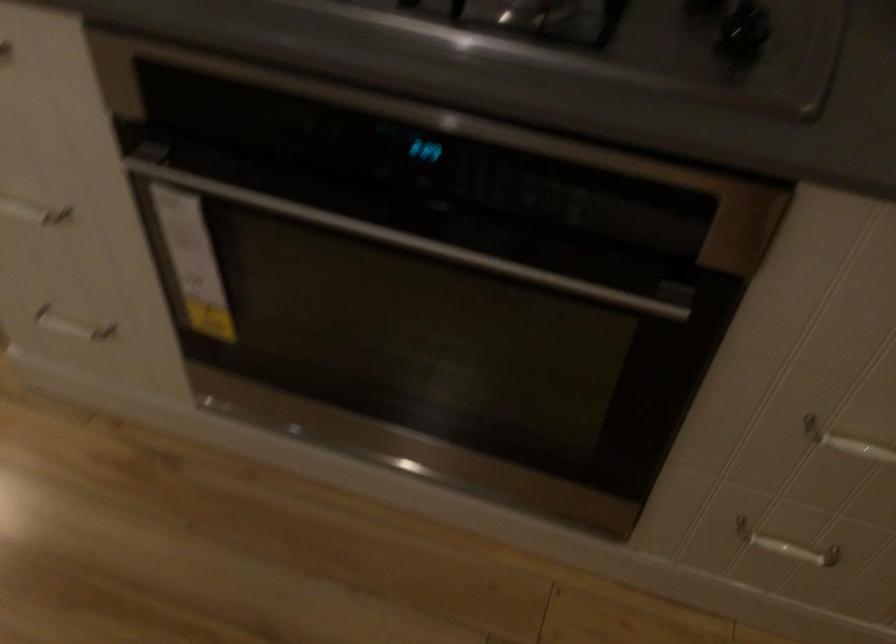
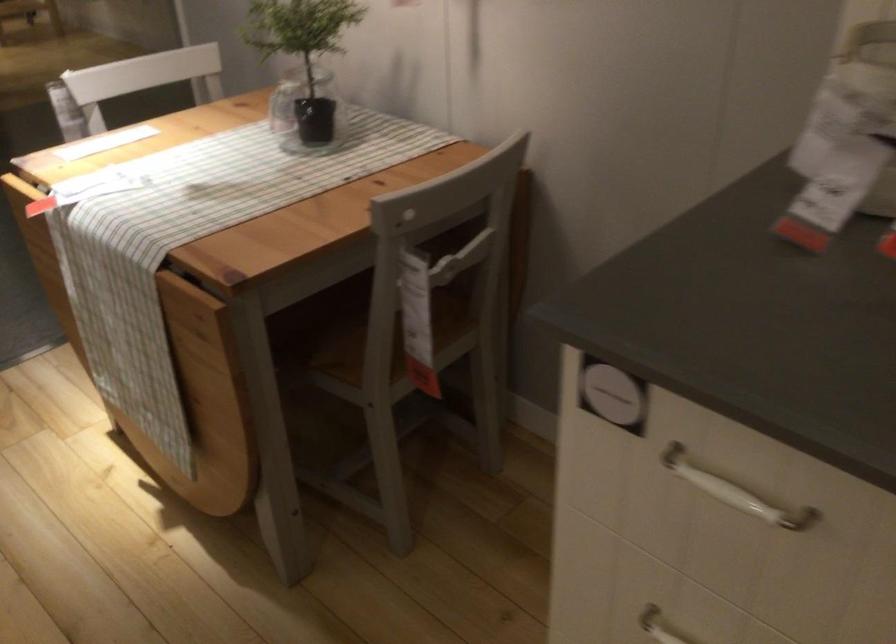
Which direction would the cameraman need to move to produce the second image?

The cameraman walked toward left, forward.